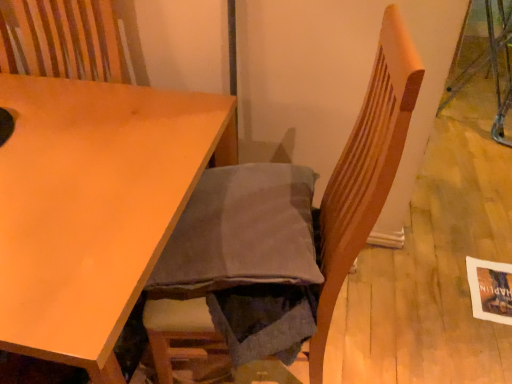
Question: Is wooden chair at center to the left or to the right of matte wood table at center in the image?

Choices:
 (A) right
 (B) left

Answer: (A)

Question: Is wooden chair at center bigger or smaller than matte wood table at center?

Choices:
 (A) small
 (B) big

Answer: (A)

Question: Is wooden chair at center inside the boundaries of matte wood table at center, or outside?

Choices:
 (A) inside
 (B) outside

Answer: (B)

Question: Is point (87, 201) closer or farther from the camera than point (180, 311)?

Choices:
 (A) farther
 (B) closer

Answer: (B)

Question: In the image, is matte wood table at center on the left side or the right side of wooden chair at center?

Choices:
 (A) right
 (B) left

Answer: (B)

Question: In terms of width, does matte wood table at center look wider or thinner when compared to wooden chair at center?

Choices:
 (A) thin
 (B) wide

Answer: (B)

Question: From the image's perspective, is matte wood table at center located above or below wooden chair at center?

Choices:
 (A) above
 (B) below

Answer: (B)